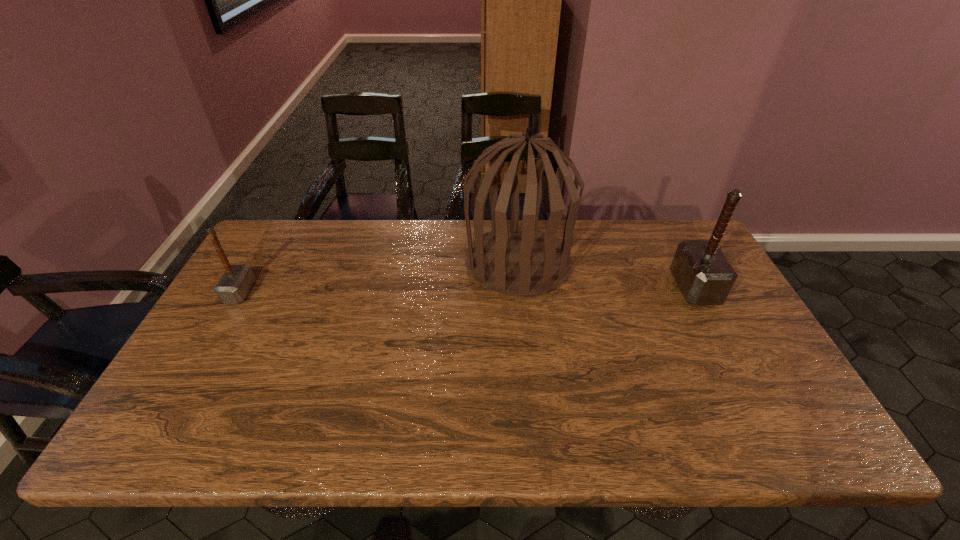
This screenshot has width=960, height=540. What are the coordinates of `free space between the shorter hammer and the right hammer` in the screenshot? It's located at (468, 290).

Locate an element on the screen. This screenshot has height=540, width=960. free space between the rightmost object and the birdcage is located at coordinates (607, 275).

This screenshot has height=540, width=960. What are the coordinates of `empty space that is in between the leftmost object and the second tallest object` in the screenshot? It's located at (468, 290).

Where is `free space between the rightmost object and the tallest object`? free space between the rightmost object and the tallest object is located at coordinates (607, 275).

Where is `blank region between the birdcage and the rightmost object`? blank region between the birdcage and the rightmost object is located at coordinates (607, 275).

Locate an element on the screen. free point between the rightmost object and the birdcage is located at coordinates (607, 275).

This screenshot has height=540, width=960. In order to click on free space between the second shortest object and the tallest object in this screenshot , I will do `click(607, 275)`.

Locate an element on the screen. The height and width of the screenshot is (540, 960). vacant area between the right hammer and the second object from left to right is located at coordinates (607, 275).

Locate an element on the screen. free area in between the second object from left to right and the second shortest object is located at coordinates (607, 275).

Identify the location of the closest object to the rightmost object. The width and height of the screenshot is (960, 540). (514, 261).